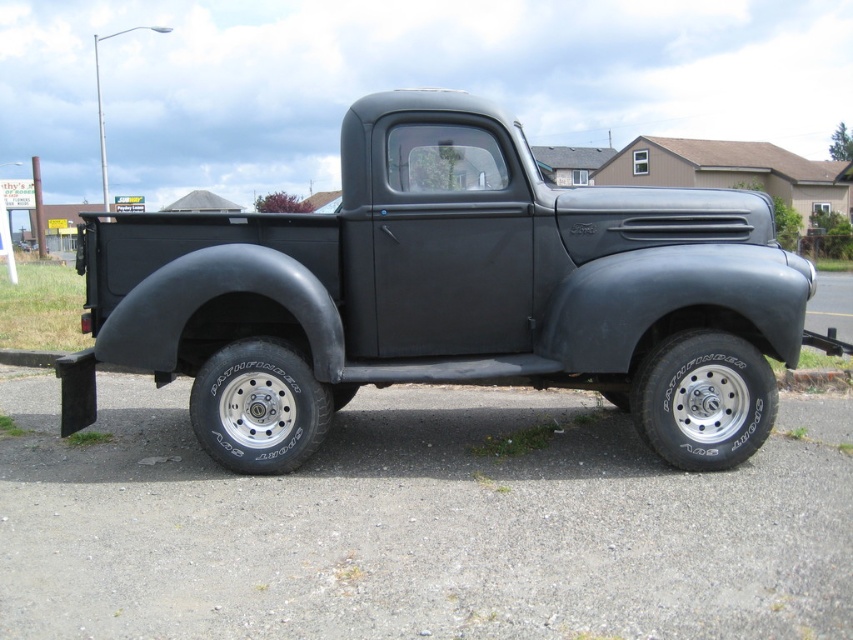
You are a delivery drone that needs to land on the matte black truck at center. The drone requires a landing zone that is at least 0.5 meters away from the edge of the truck. Given the truck is positioned at coordinates point 0.461, 0.528, can you confirm if the landing zone is safe?

The matte black truck at center is positioned at point (x=450, y=294). Since the drone requires a landing zone at least 0.5 meters away from the edge, and the truck is centered at those coordinates, the landing zone is safe as long as the drone lands within the truck bed while maintaining the required distance from the edges.

You are standing at the origin point of a coordinate system where the image is represented. The truck is at coordinates given in the description. If you want to move directly towards the matte black truck at center, in which direction should you move?

You should move in the direction of the coordinates point (450, 294) to reach the matte black truck at center.

You are standing at the origin point of the coordinate system where the bottom left corner of the image is the origin. You want to place a small red flag exactly at the position of the black rubber tire at lower right. What coordinates should you aim for?

You should aim for the coordinates (703,400) to place the red flag at the position of the black rubber tire at lower right.